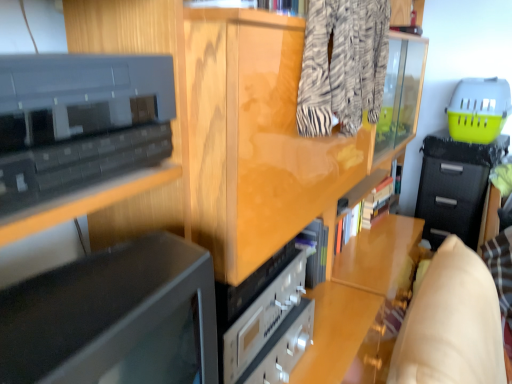
Question: From a real-world perspective, is black glossy cabinet at upper left beneath zebra-patterned fabric at upper center?

Choices:
 (A) yes
 (B) no

Answer: (A)

Question: Is black glossy cabinet at upper left at the left side of zebra-patterned fabric at upper center?

Choices:
 (A) yes
 (B) no

Answer: (A)

Question: Is black glossy cabinet at upper left shorter than zebra-patterned fabric at upper center?

Choices:
 (A) no
 (B) yes

Answer: (B)

Question: Does black glossy cabinet at upper left come behind zebra-patterned fabric at upper center?

Choices:
 (A) no
 (B) yes

Answer: (A)

Question: Can you confirm if black glossy cabinet at upper left is bigger than zebra-patterned fabric at upper center?

Choices:
 (A) yes
 (B) no

Answer: (B)

Question: Does point (342, 44) appear closer or farther from the camera than point (6, 183)?

Choices:
 (A) closer
 (B) farther

Answer: (B)

Question: Which is correct: zebra-patterned fabric at upper center is inside black glossy cabinet at upper left, or outside of it?

Choices:
 (A) outside
 (B) inside

Answer: (A)

Question: Relative to black glossy cabinet at upper left, is zebra-patterned fabric at upper center in front or behind?

Choices:
 (A) behind
 (B) front

Answer: (A)

Question: In terms of width, does zebra-patterned fabric at upper center look wider or thinner when compared to black glossy cabinet at upper left?

Choices:
 (A) wide
 (B) thin

Answer: (B)

Question: Is black fabric drawer at right taller or shorter than black glossy cabinet at upper left?

Choices:
 (A) short
 (B) tall

Answer: (B)

Question: Is point (443, 170) positioned closer to the camera than point (112, 145)?

Choices:
 (A) closer
 (B) farther

Answer: (B)

Question: From a real-world perspective, relative to black glossy cabinet at upper left, is black fabric drawer at right vertically above or below?

Choices:
 (A) above
 (B) below

Answer: (B)

Question: From the image's perspective, is black fabric drawer at right positioned above or below black glossy cabinet at upper left?

Choices:
 (A) below
 (B) above

Answer: (A)

Question: Considering the positions of zebra-patterned fabric at upper center and black fabric drawer at right in the image, is zebra-patterned fabric at upper center wider or thinner than black fabric drawer at right?

Choices:
 (A) wide
 (B) thin

Answer: (B)

Question: Is zebra-patterned fabric at upper center in front of or behind black fabric drawer at right in the image?

Choices:
 (A) behind
 (B) front

Answer: (B)